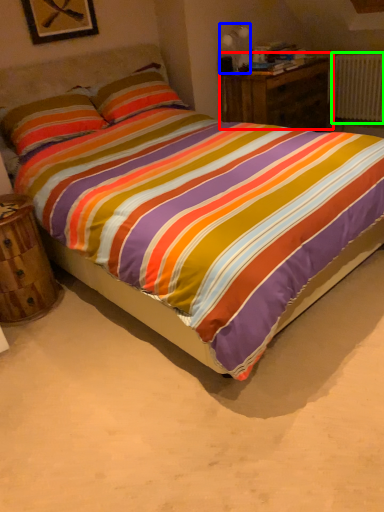
Question: Which object is positioned farthest from nightstand (highlighted by a red box)? Select from table lamp (highlighted by a blue box) and radiator (highlighted by a green box).

Choices:
 (A) table lamp
 (B) radiator

Answer: (B)